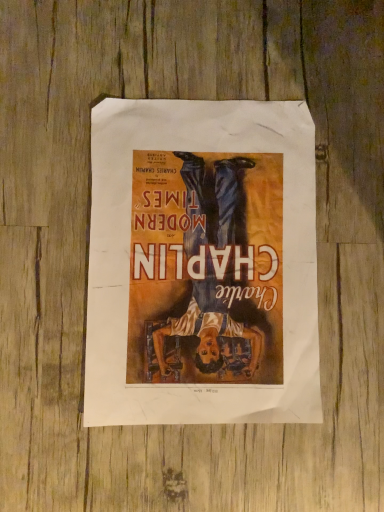
What do you see at coordinates (202, 264) in the screenshot? I see `matte paper poster at center` at bounding box center [202, 264].

At what (x,y) coordinates should I click in order to perform the action: click on matte paper poster at center. Please return your answer as a coordinate pair (x, y). Looking at the image, I should click on (202, 264).

The image size is (384, 512). What are the coordinates of `matte paper poster at center` in the screenshot? It's located at (202, 264).